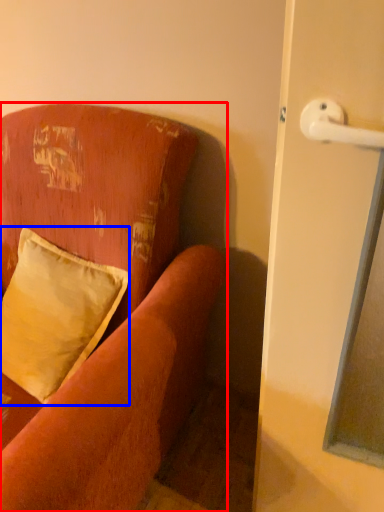
Question: Which of the following is the closest to the observer, studio couch (highlighted by a red box) or pillow (highlighted by a blue box)?

Choices:
 (A) studio couch
 (B) pillow

Answer: (A)